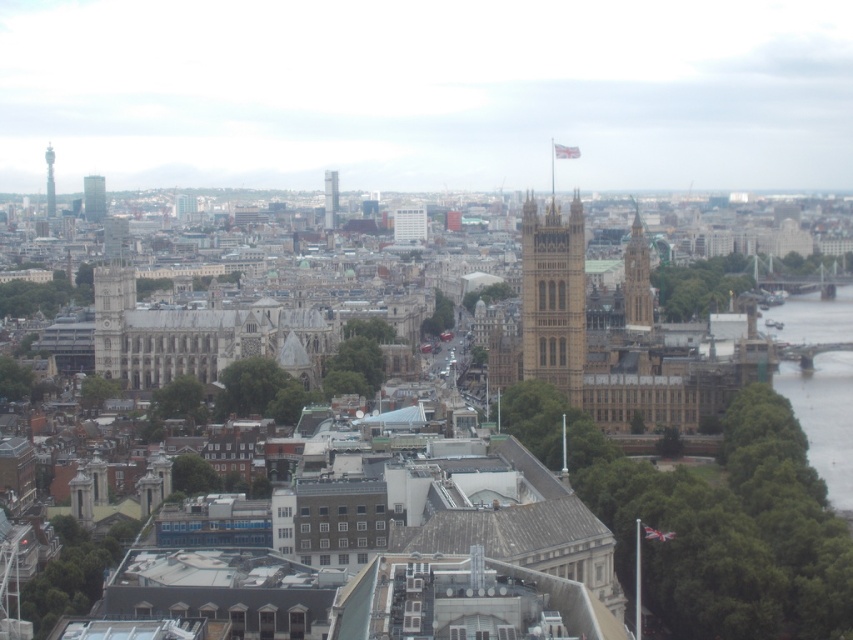
You are a city planner analyzing the skyline. You need to determine if the golden stone tower at center right can block the view of the silver metallic tower at left from a specific observation point. Based on their widths, can you infer anything about their potential to block each other?

The golden stone tower at center right might be wider than silver metallic tower at left, so it could potentially block the view of the silver metallic tower at left more effectively if positioned between the observation point and the narrower tower.

You are a drone operator who needs to deliver a package to the golden stone tower at center. The drone has a maximum flight range of 300 meters. Can the drone reach the tower?

The golden stone tower at center is 275.90 meters from camera, so yes, the drone can reach the tower since it is within the 300 meters range.

You are a tourist in London and want to take a photo of both the golden stone tower at center right and the silver metallic tower at left. Which tower should you stand closer to in order to capture both in a single frame?

You should stand closer to the silver metallic tower at left because it is shorter than the golden stone tower at center right, allowing both to fit within the camera frame when positioned appropriately.